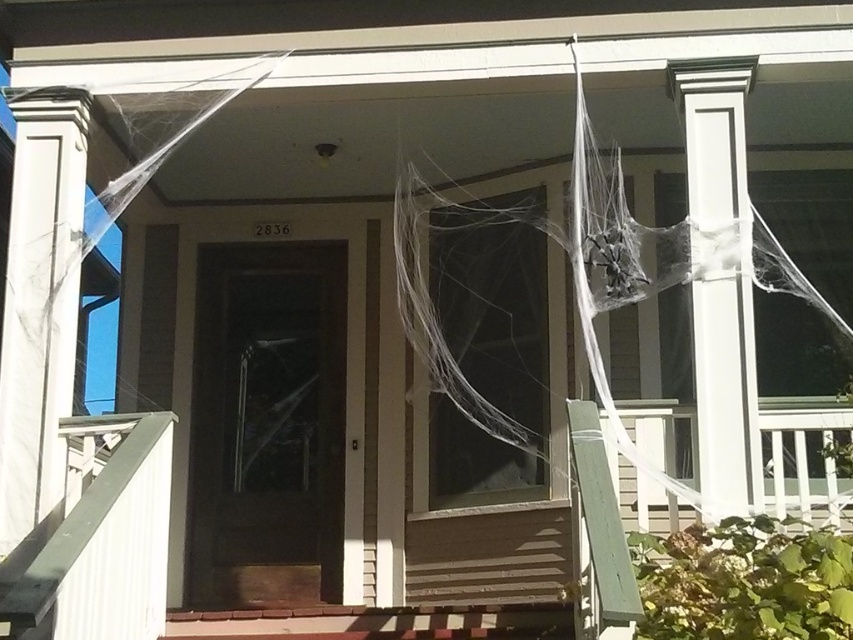
Question: Which of the following is the farthest from the observer?

Choices:
 (A) silvery metallic spider at center-right
 (B) white smooth column at left
 (C) dark wood screen door at center
 (D) white painted wood column at center

Answer: (C)

Question: Can you confirm if dark wood screen door at center is positioned below translucent white spider web at center?

Choices:
 (A) yes
 (B) no

Answer: (A)

Question: Is dark wood screen door at center bigger than silvery metallic spider at center-right?

Choices:
 (A) yes
 (B) no

Answer: (A)

Question: Can you confirm if dark wood screen door at center is positioned above translucent white spider web at center?

Choices:
 (A) yes
 (B) no

Answer: (B)

Question: Which object is positioned closest to the dark wood screen door at center?

Choices:
 (A) translucent white spider web at center
 (B) white painted wood column at center
 (C) white smooth column at left
 (D) silvery metallic spider at center-right

Answer: (A)

Question: Which of the following is the farthest from the observer?

Choices:
 (A) silvery metallic spider at center-right
 (B) white painted wood column at center

Answer: (A)